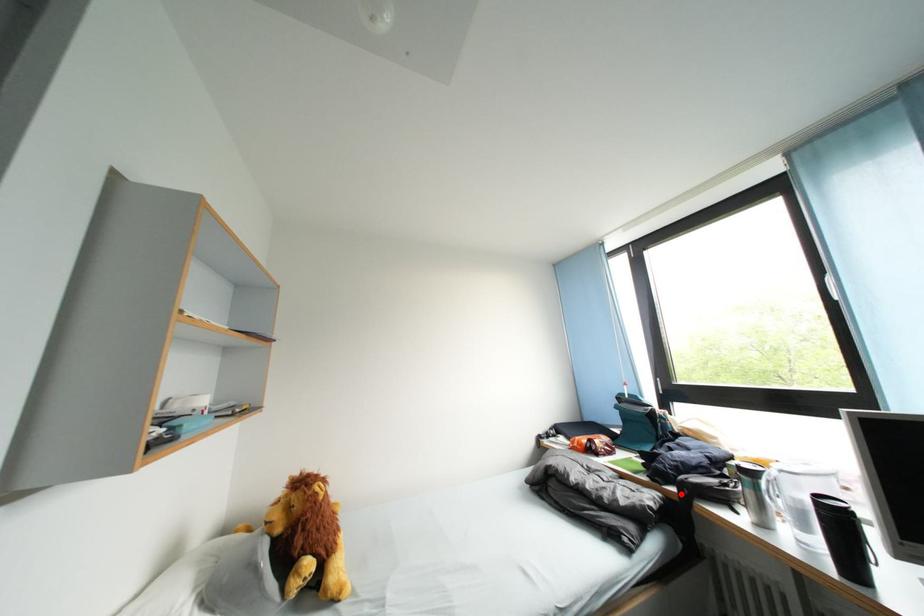
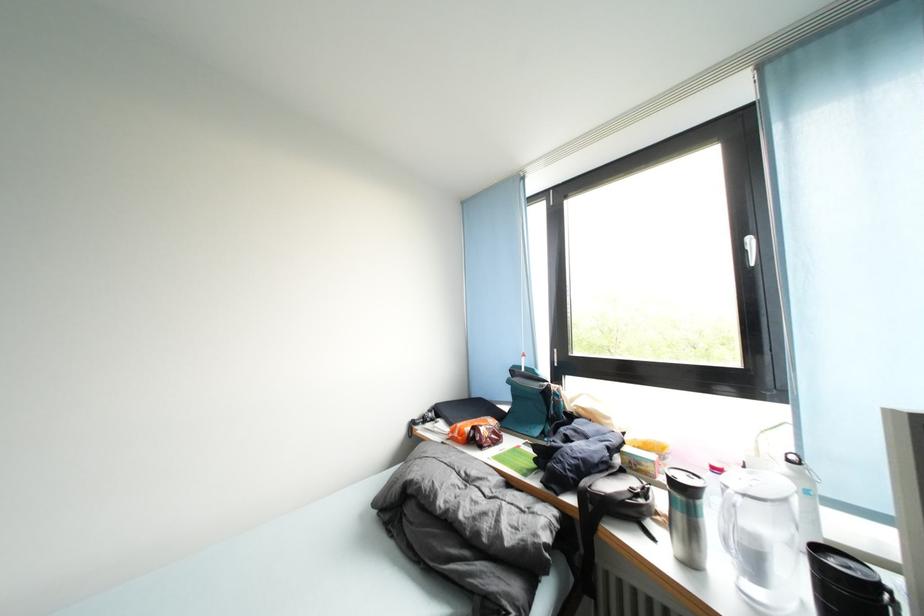
In the second image, find the point that corresponds to the highlighted location in the first image.

(579, 505)